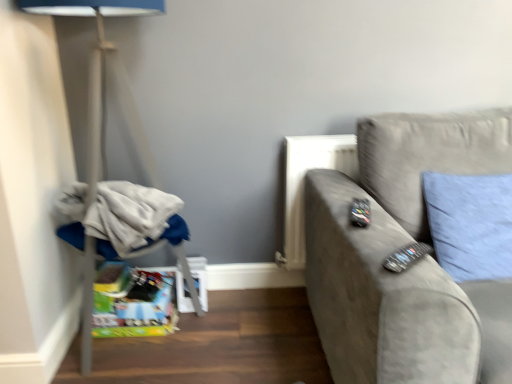
Question: Is suede gray couch at right a part of blue fabric pillow at right?

Choices:
 (A) no
 (B) yes

Answer: (A)

Question: Is blue fabric pillow at right in front of suede gray couch at right?

Choices:
 (A) yes
 (B) no

Answer: (B)

Question: From the image's perspective, is blue fabric pillow at right located above suede gray couch at right?

Choices:
 (A) no
 (B) yes

Answer: (B)

Question: Does blue fabric pillow at right turn towards suede gray couch at right?

Choices:
 (A) yes
 (B) no

Answer: (A)

Question: Can you confirm if blue fabric pillow at right is positioned to the left of suede gray couch at right?

Choices:
 (A) yes
 (B) no

Answer: (B)

Question: In terms of width, does white fabric at left look wider or thinner when compared to black plastic remote at right, which is the 2th remote from bottom to top?

Choices:
 (A) thin
 (B) wide

Answer: (B)

Question: In terms of height, does white fabric at left look taller or shorter compared to black plastic remote at right, which is counted as the second remote, starting from the front?

Choices:
 (A) short
 (B) tall

Answer: (B)

Question: Choose the correct answer: Is white fabric at left inside black plastic remote at right, which is counted as the second remote, starting from the front, or outside it?

Choices:
 (A) inside
 (B) outside

Answer: (B)

Question: From a real-world perspective, is white fabric at left physically located above or below black plastic remote at right, acting as the 1th remote starting from the top?

Choices:
 (A) below
 (B) above

Answer: (A)

Question: Which is correct: suede gray couch at right is inside white fabric at left, or outside of it?

Choices:
 (A) outside
 (B) inside

Answer: (A)

Question: Based on their positions, is suede gray couch at right located to the left or right of white fabric at left?

Choices:
 (A) left
 (B) right

Answer: (B)

Question: From a real-world perspective, is suede gray couch at right physically located above or below white fabric at left?

Choices:
 (A) below
 (B) above

Answer: (A)

Question: Considering their positions, is suede gray couch at right located in front of or behind white fabric at left?

Choices:
 (A) behind
 (B) front

Answer: (B)

Question: Considering the positions of point (74, 196) and point (394, 264), is point (74, 196) closer or farther from the camera than point (394, 264)?

Choices:
 (A) farther
 (B) closer

Answer: (A)

Question: From their relative heights in the image, would you say white fabric at left is taller or shorter than black plastic remote at right, the second remote when ordered from top to bottom?

Choices:
 (A) tall
 (B) short

Answer: (A)